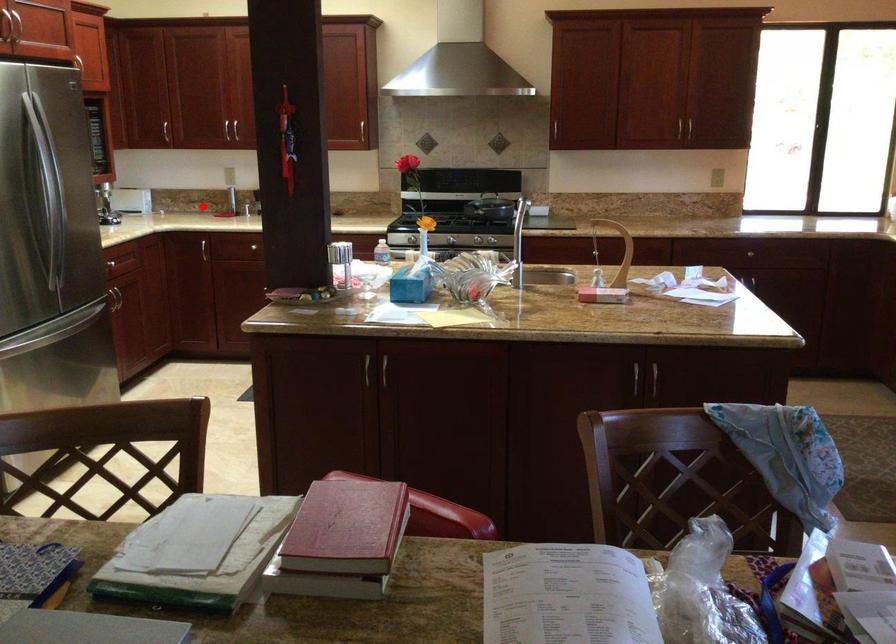
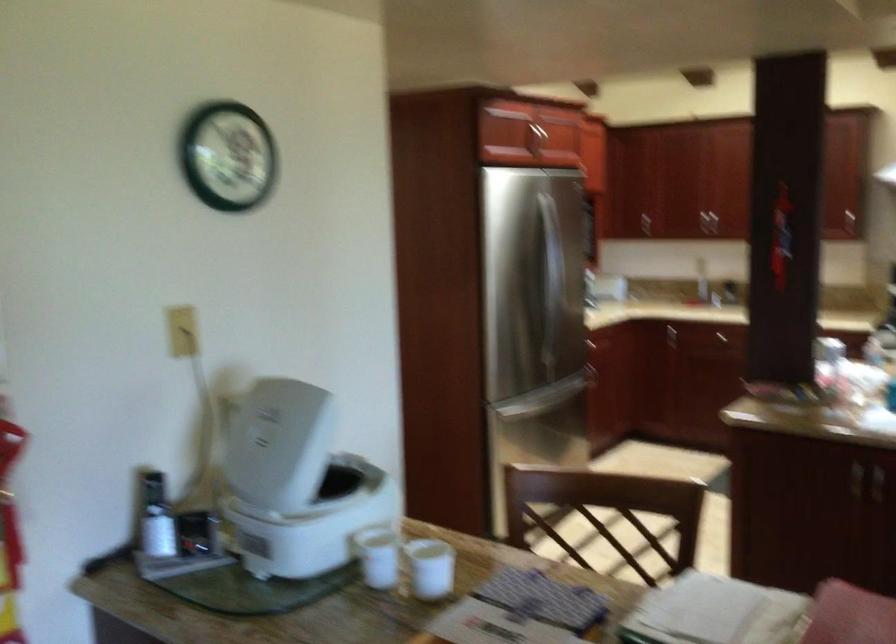
Question: I am providing you with two images of the same scene from different viewpoints. A red point is marked on the first image. Can you still see the location of the red point in image 2?

Choices:
 (A) Yes
 (B) No

Answer: (B)